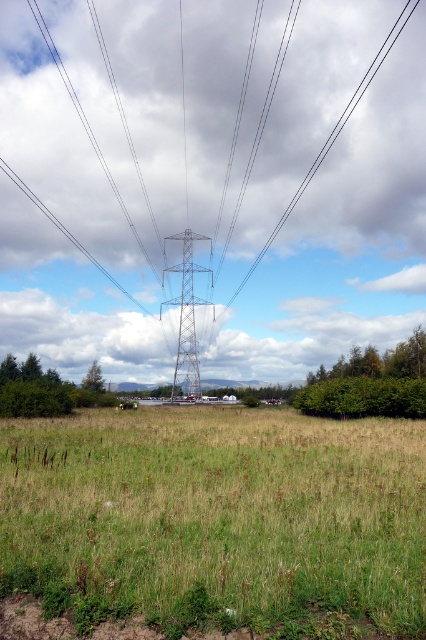
You are a landscape photographer planning to capture the entire scene in one shot. Given that the green grassy field at center and the metallic silver tower at center must both be visible, which object will appear larger in your photo?

The metallic silver tower at center will appear larger in the photo because it occupies more space than the green grassy field at center according to the description.

You are standing in the middle of the green grassy field at center and want to look up at the metallic silver tower at center. Which direction should you look to see the tower?

You should look upward because the metallic silver tower at center is above the green grassy field at center.

You are standing in the green grassy field at center and want to take a photo of the metallic silver tower at center. Which object is closer to the camera to ensure the tower is in focus?

The green grassy field at center is in front of the metallic silver tower at center, so the tower will be further away. To ensure the tower is in focus, the camera should focus on the metallic silver tower at center since it is farther back.